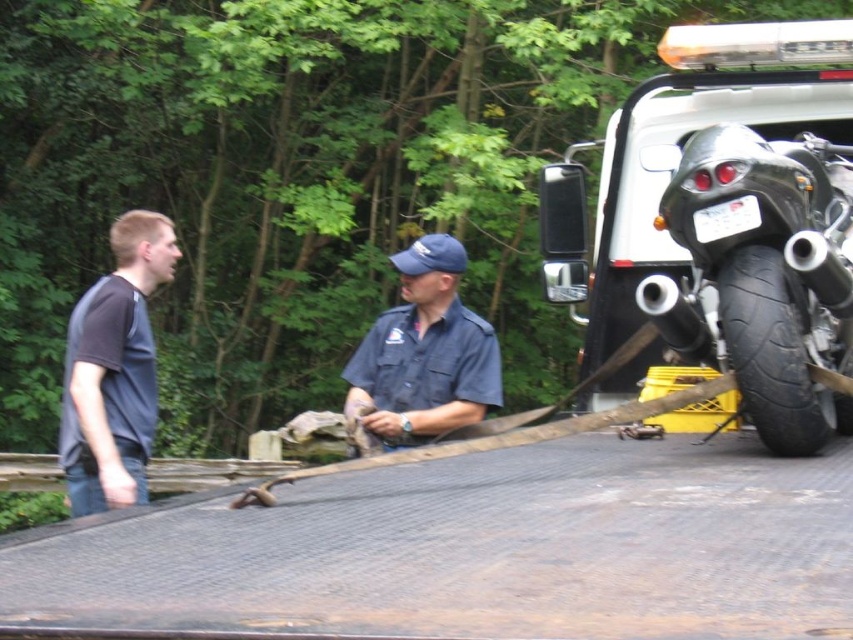
Is point (672, 307) behind point (403, 397)?

No, (672, 307) is closer to viewer.

Is point (798, 352) farther from viewer compared to point (416, 330)?

That is False.

Identify the location of shiny black motorcycle at right. (764, 276).

Does blue uniform shirt at center appear on the left side of black rubber tire at right?

Yes, blue uniform shirt at center is to the left of black rubber tire at right.

Is blue uniform shirt at center further to camera compared to black rubber tire at right?

That is True.

Is point (354, 371) positioned in front of point (802, 320)?

No, it is behind (802, 320).

This screenshot has width=853, height=640. Identify the location of blue uniform shirt at center. (424, 353).

Based on the photo, is shiny black motorcycle at right behind black rubber tire at right?

Yes, shiny black motorcycle at right is further from the viewer.

Is shiny black motorcycle at right bigger than black rubber tire at right?

Yes, shiny black motorcycle at right is bigger than black rubber tire at right.

Is point (752, 216) positioned after point (724, 317)?

No, it is in front of (724, 317).

Locate an element on the screen. The image size is (853, 640). shiny black motorcycle at right is located at coordinates (x=764, y=276).